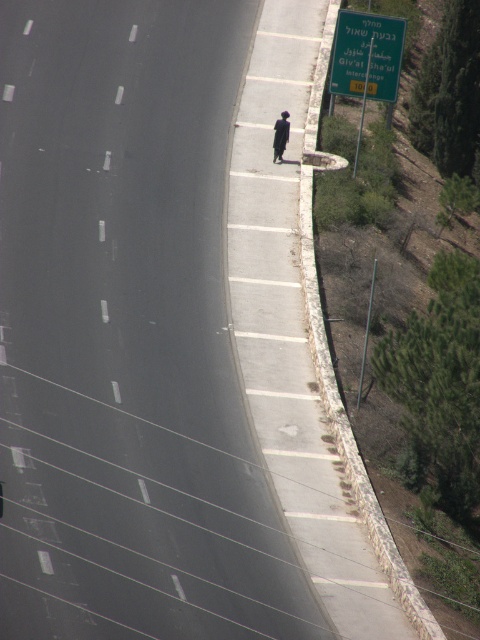
Question: Is dirt path at right further to the viewer compared to green plastic sign at upper right?

Choices:
 (A) yes
 (B) no

Answer: (B)

Question: Estimate the real-world distances between objects in this image. Which object is closer to the dark fabric person at right?

Choices:
 (A) green plastic sign at upper right
 (B) dirt path at right

Answer: (A)

Question: Which object appears closest to the camera in this image?

Choices:
 (A) dirt path at right
 (B) dark fabric person at right

Answer: (A)

Question: Is green plastic sign at upper right behind dark fabric person at right?

Choices:
 (A) no
 (B) yes

Answer: (B)

Question: Estimate the real-world distances between objects in this image. Which object is farther from the dark fabric person at right?

Choices:
 (A) dirt path at right
 (B) green plastic sign at upper right

Answer: (A)

Question: Is dirt path at right bigger than green plastic sign at upper right?

Choices:
 (A) yes
 (B) no

Answer: (A)